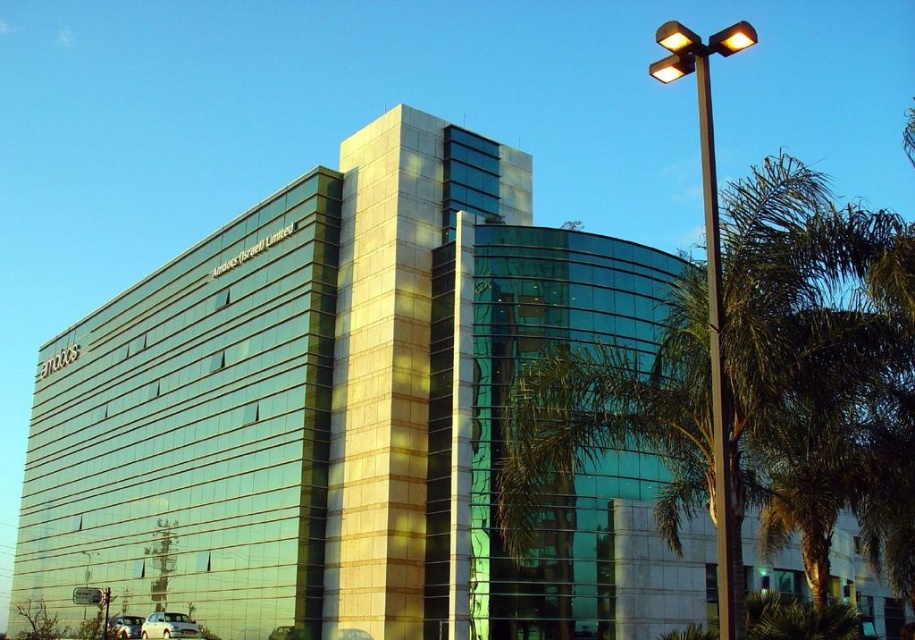
You are standing in front of the office building and want to determine which of the two points, point (765, 432) or point (746, 24), is closer to you. Can you figure out which one is nearer?

Point (765, 432) is closer to you because it is further to the viewer than point (746, 24).

You are a delivery person trying to park your 1.2 meter wide delivery van between the green leafy palm tree at right and the black metal pole at right. Can you fit your van there?

The green leafy palm tree at right might be wider than black metal pole at right, so it is uncertain if there is enough space for the van. Check the actual width before parking.